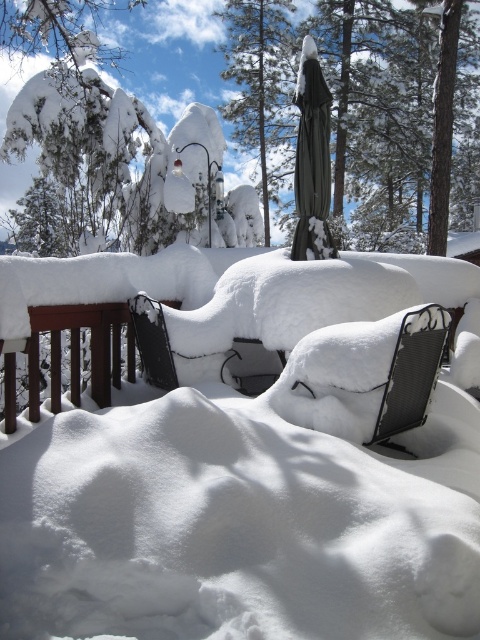
Question: Among these points, which one is nearest to the camera?

Choices:
 (A) (244, 365)
 (B) (189, 61)
 (C) (346, 429)

Answer: (C)

Question: Can you confirm if white snow-covered tree at upper left is thinner than black mesh chair at center?

Choices:
 (A) yes
 (B) no

Answer: (B)

Question: Estimate the real-world distances between objects in this image. Which object is farther from the snow-covered tree at center?

Choices:
 (A) white mesh folding chair at center
 (B) black mesh chair at center
 (C) white snow-covered tree at upper left

Answer: (A)

Question: Is white snow-covered tree at upper left above black mesh chair at center?

Choices:
 (A) no
 (B) yes

Answer: (B)

Question: Which point appears farthest from the camera in this image?

Choices:
 (A) [x=357, y=440]
 (B) [x=113, y=42]

Answer: (B)

Question: Can you confirm if white snow-covered tree at upper left is wider than snow-covered tree at center?

Choices:
 (A) yes
 (B) no

Answer: (A)